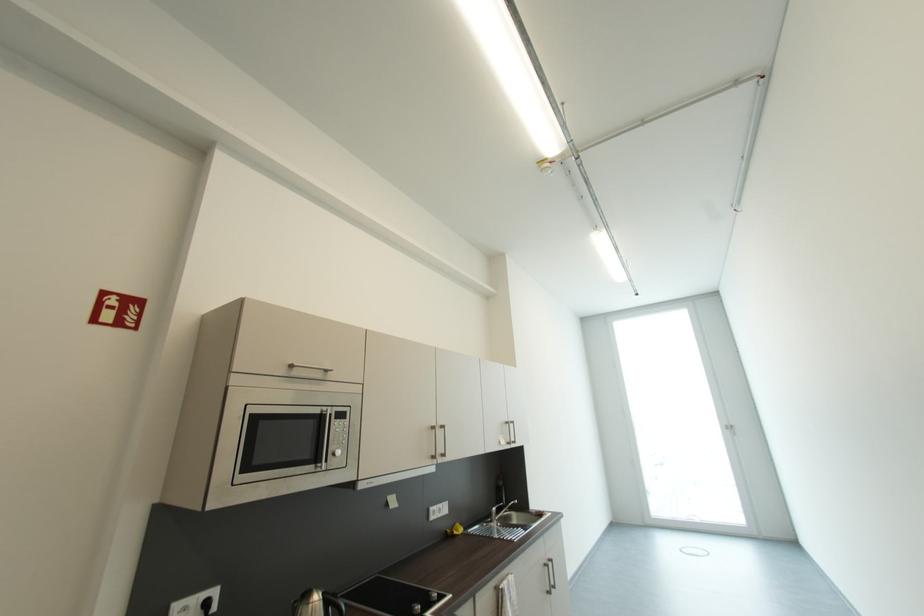
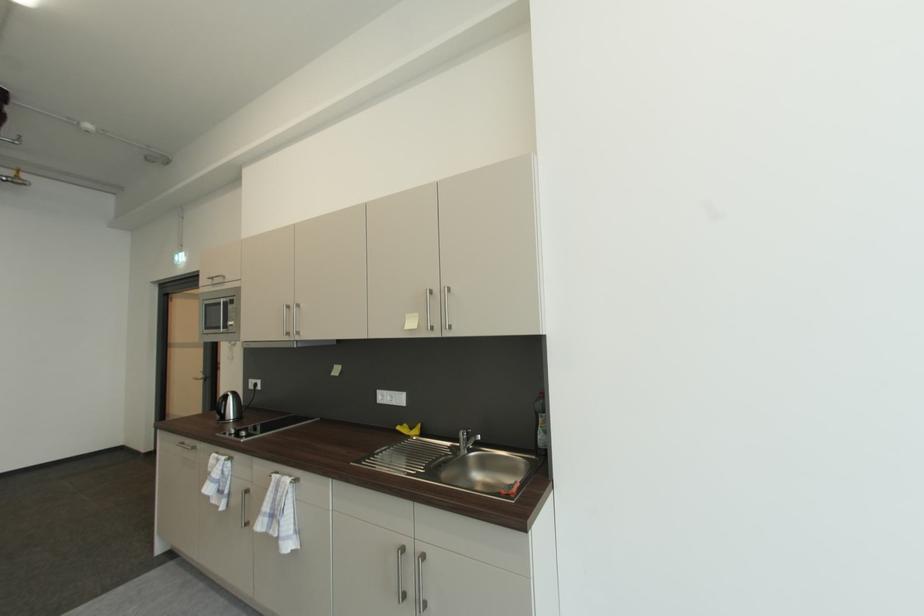
Find the pixel in the second image that matches (454,533) in the first image.

(408, 427)